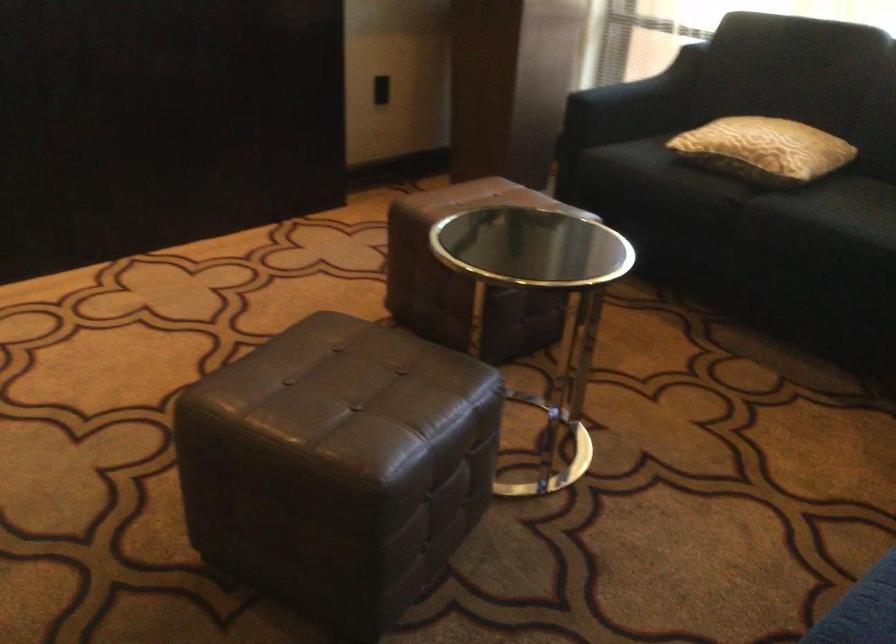
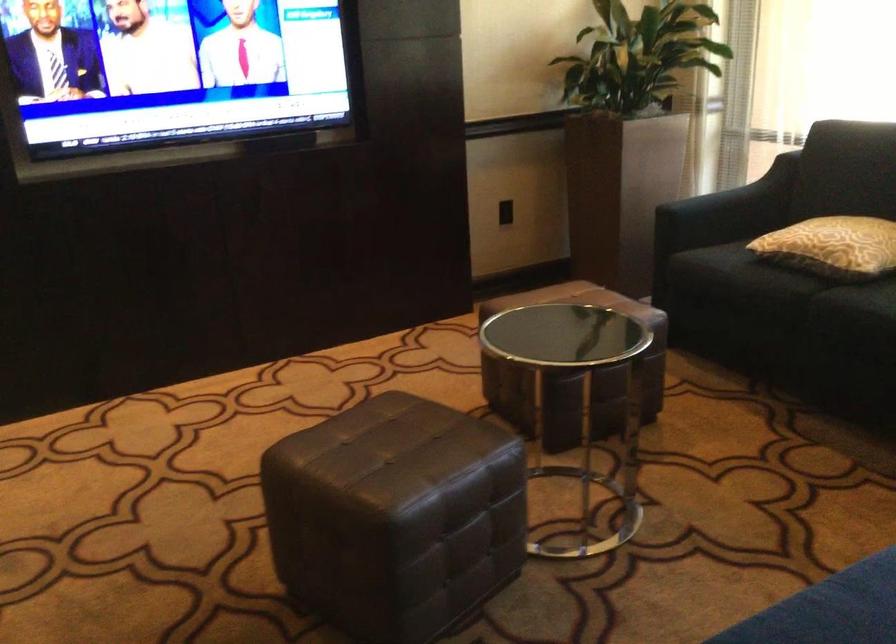
The images are taken continuously from a first-person perspective. In which direction are you moving?

The movement direction of the cameraman is right, backward.